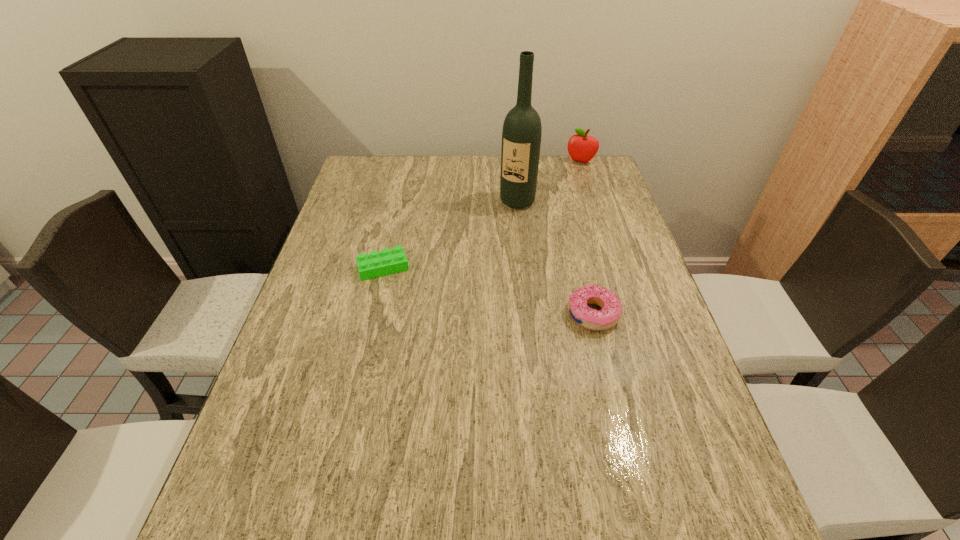
Locate an element on the screen. free spot between the farthest object and the wine bottle is located at coordinates tap(549, 181).

Where is `vacant point located between the second nearest object and the third shortest object`? vacant point located between the second nearest object and the third shortest object is located at coordinates (482, 215).

The height and width of the screenshot is (540, 960). What are the coordinates of `unoccupied area between the third object from right to left and the third farthest object` in the screenshot? It's located at (450, 234).

Locate an element on the screen. The height and width of the screenshot is (540, 960). vacant area that lies between the nearest object and the wine bottle is located at coordinates (x=555, y=258).

Identify the location of vacant area that lies between the farthest object and the leftmost object. Image resolution: width=960 pixels, height=540 pixels. (482, 215).

Image resolution: width=960 pixels, height=540 pixels. I want to click on blank region between the third nearest object and the apple, so click(x=549, y=181).

Where is `vacant space that's between the second nearest object and the nearest object`? vacant space that's between the second nearest object and the nearest object is located at coordinates (488, 291).

Where is `object that is the second closest to the nearest object`? This screenshot has width=960, height=540. object that is the second closest to the nearest object is located at coordinates (388, 261).

Identify which object is located as the second nearest to the second tallest object. Please provide its 2D coordinates. Your answer should be formatted as a tuple, i.e. [(x, y)], where the tuple contains the x and y coordinates of a point satisfying the conditions above.

[(610, 314)]

I want to click on free space that satisfies the following two spatial constraints: 1. on the front side of the wine bottle; 2. on the left side of the nearest object, so click(529, 314).